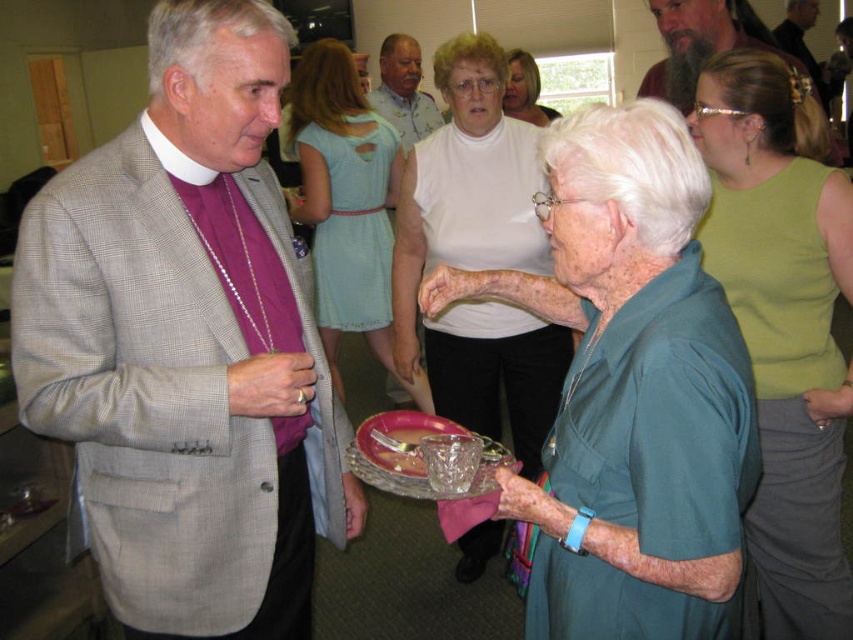
Question: Can you confirm if pink glass platter at center is positioned below gray wool suit at center?

Choices:
 (A) yes
 (B) no

Answer: (A)

Question: Which of these objects is positioned farthest from the green sleeveless top at upper right?

Choices:
 (A) gray wool suit at center
 (B) matte white blouse at center
 (C) bearded man at upper center

Answer: (A)

Question: Considering the real-world distances, which object is farthest from the black leather jacket at upper right?

Choices:
 (A) white t-shirt at center
 (B) matte white blouse at center
 (C) bearded man at upper center

Answer: (B)

Question: Does green sleeveless top at upper right have a larger size compared to white t-shirt at center?

Choices:
 (A) no
 (B) yes

Answer: (B)

Question: Which point is farther from the camera taking this photo?

Choices:
 (A) [x=352, y=221]
 (B) [x=387, y=70]
 (C) [x=807, y=48]
 (D) [x=396, y=458]

Answer: (C)

Question: Is teal fabric shirt at center positioned at the back of green sleeveless top at upper right?

Choices:
 (A) no
 (B) yes

Answer: (A)